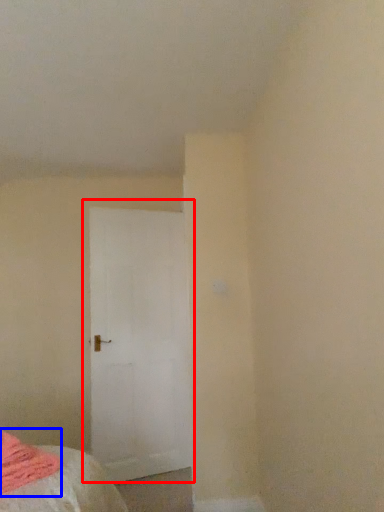
Question: Which point is closer to the camera, door (highlighted by a red box) or blanket (highlighted by a blue box)?

Choices:
 (A) door
 (B) blanket

Answer: (B)